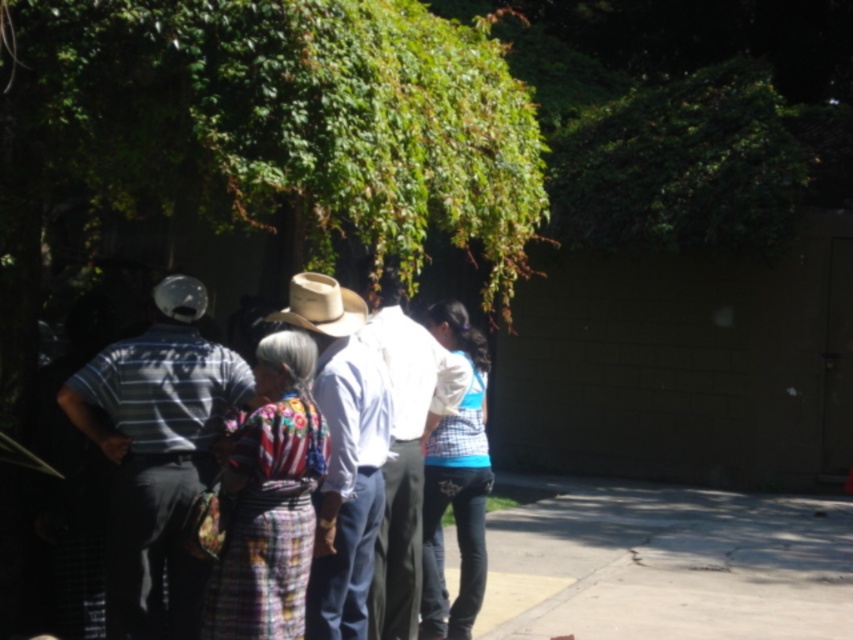
You are a photographer trying to capture both the light brown woven hat at center and the light brown straw cowboy hat at center in a single frame. Given that your camera has a maximum width coverage of 1 meter, can both hats be included without moving the camera?

The light brown woven hat at center is wider than the light brown straw cowboy hat at center. However, since the camera can cover up to 1 meter, and the combined width of both hats is not provided, it is impossible to determine if they fit without additional information.